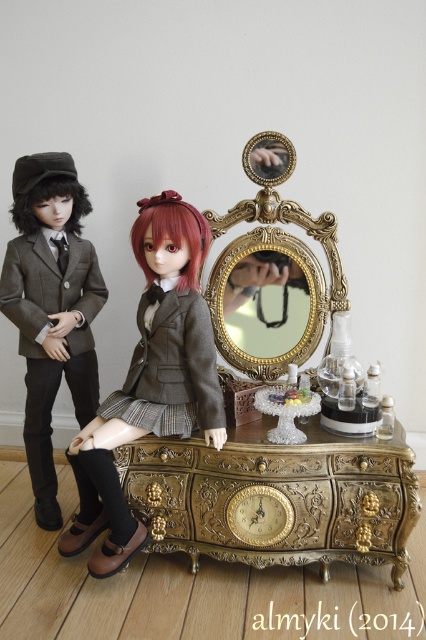
How much distance is there between gold ornate drawer at center and matte gray fabric doll at center?

They are 11.59 inches apart.

Is point (399, 548) behind point (135, 522)?

No.

Is point (169, 532) positioned behind point (140, 433)?

That is True.

The image size is (426, 640). In order to click on gold ornate drawer at center in this screenshot , I will do [275, 497].

Can you confirm if gold ornate drawer at center is positioned above gold ornate mirror at center?

No, gold ornate drawer at center is not above gold ornate mirror at center.

Does point (299, 468) come in front of point (291, 310)?

Yes, it is.

The image size is (426, 640). Identify the location of gold ornate drawer at center. (275, 497).

This screenshot has height=640, width=426. I want to click on gold ornate drawer at center, so click(275, 497).

Is matte brown suit at left above gold ornate mirror at center?

Incorrect, matte brown suit at left is not positioned above gold ornate mirror at center.

Looking at this image, measure the distance between matte brown suit at left and camera.

A distance of 6.93 feet exists between matte brown suit at left and camera.

What do you see at coordinates (51, 307) in the screenshot? The width and height of the screenshot is (426, 640). I see `matte brown suit at left` at bounding box center [51, 307].

This screenshot has width=426, height=640. I want to click on matte brown suit at left, so click(x=51, y=307).